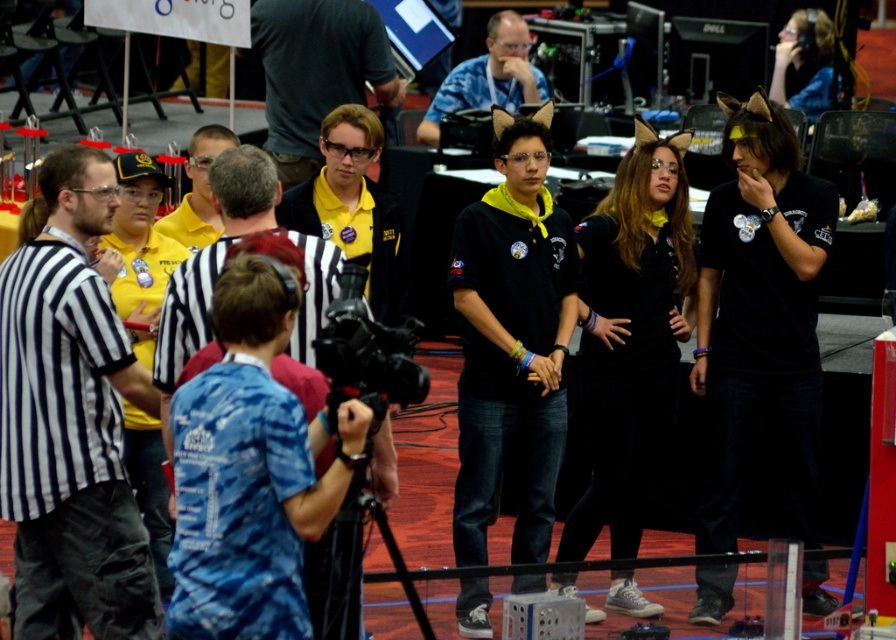
Question: Which of the following is the farthest from the observer?

Choices:
 (A) (336, 397)
 (B) (13, 429)
 (C) (535, 70)

Answer: (C)

Question: Which object appears farthest from the camera in this image?

Choices:
 (A) matte black jacket at center
 (B) blue fabric shirt at center

Answer: (B)

Question: Does black plastic video camera at center appear over blue fabric shirt at center?

Choices:
 (A) yes
 (B) no

Answer: (B)

Question: Considering the relative positions of black striped shirt at left and blue fabric shirt at center in the image provided, where is black striped shirt at left located with respect to blue fabric shirt at center?

Choices:
 (A) below
 (B) above

Answer: (A)

Question: Is matte black jacket at center thinner than black plastic video camera at center?

Choices:
 (A) no
 (B) yes

Answer: (A)

Question: Estimate the real-world distances between objects in this image. Which object is closer to the matte black jacket at center?

Choices:
 (A) black striped shirt at left
 (B) black plastic video camera at center
 (C) matte yellow shirt at center

Answer: (A)